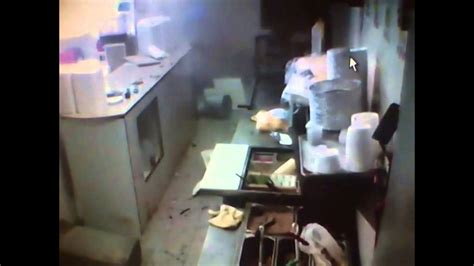
Locate an element on the screen. The height and width of the screenshot is (266, 474). cups is located at coordinates (369, 148).